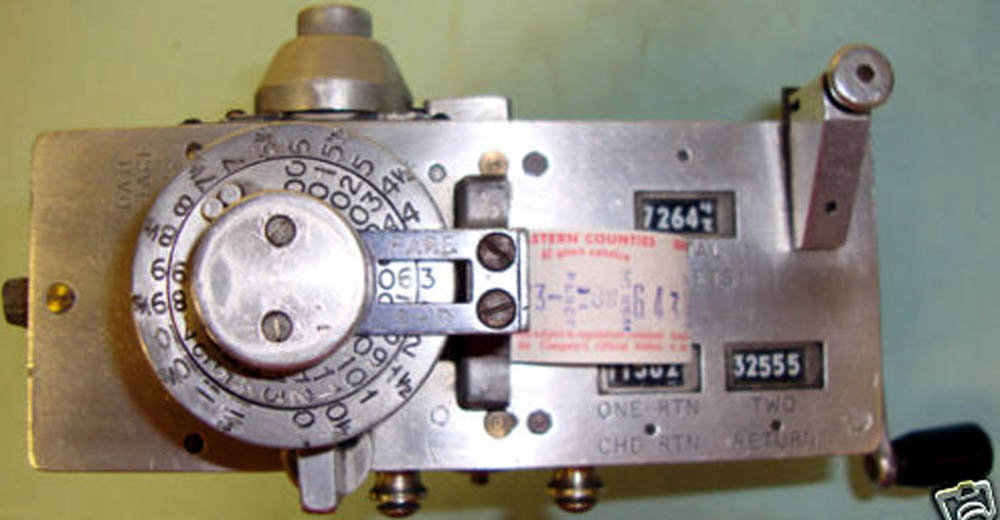
This screenshot has width=1000, height=520. Find the location of `handle`. handle is located at coordinates (939, 454).